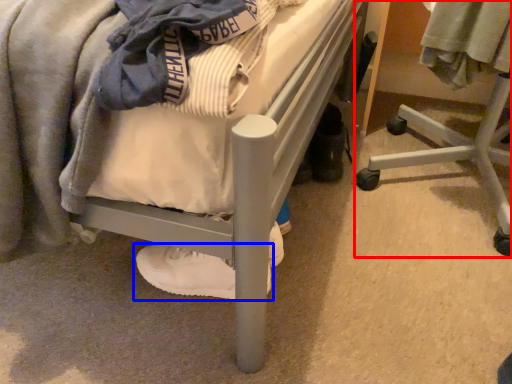
Question: Which point is further to the camera, furniture (highlighted by a red box) or footwear (highlighted by a blue box)?

Choices:
 (A) furniture
 (B) footwear

Answer: (B)